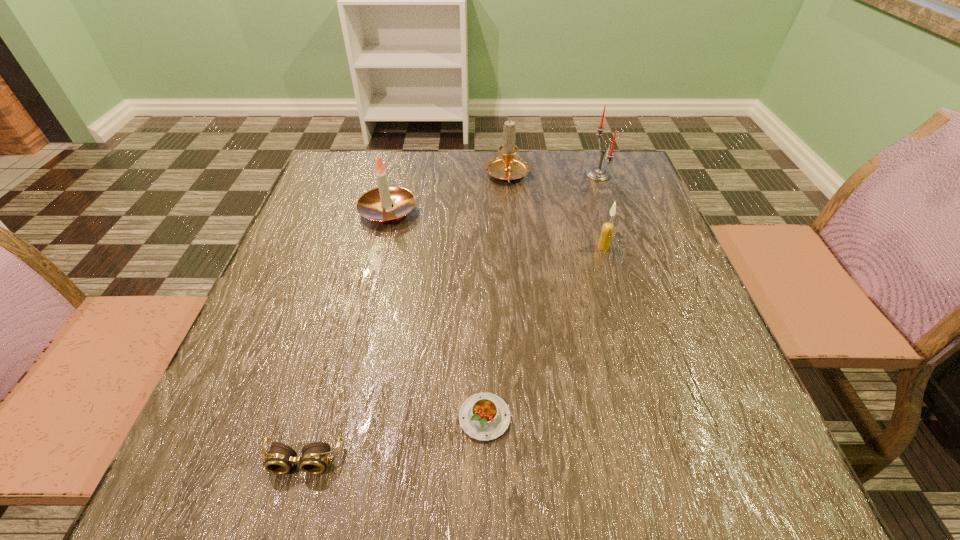
I want to click on the rightmost object, so click(599, 174).

You are a GUI agent. You are given a task and a screenshot of the screen. Output one action in this format:
    pyautogui.click(x=<x>, y=<y>)
    Task: Click on the third candle from right to left
    
    Given the screenshot: What is the action you would take?
    pyautogui.click(x=507, y=167)

Locate an element on the screen. The image size is (960, 540). the third farthest candle is located at coordinates (376, 204).

Locate an element on the screen. The image size is (960, 540). the fourth nearest object is located at coordinates (376, 204).

You are a GUI agent. You are given a task and a screenshot of the screen. Output one action in this format:
    pyautogui.click(x=<x>, y=<y>)
    Task: Click on the fourth tallest object
    Image resolution: width=960 pixels, height=540 pixels.
    Given the screenshot: What is the action you would take?
    pyautogui.click(x=607, y=229)

The image size is (960, 540). Identify the location of the second candle from right to left. (607, 229).

The height and width of the screenshot is (540, 960). Find the location of `goggles`. goggles is located at coordinates (279, 460).

The height and width of the screenshot is (540, 960). Identify the location of the fifth tallest object. (279, 460).

I want to click on the second nearest object, so (x=484, y=416).

Where is `pudding`? The image size is (960, 540). pudding is located at coordinates (484, 416).